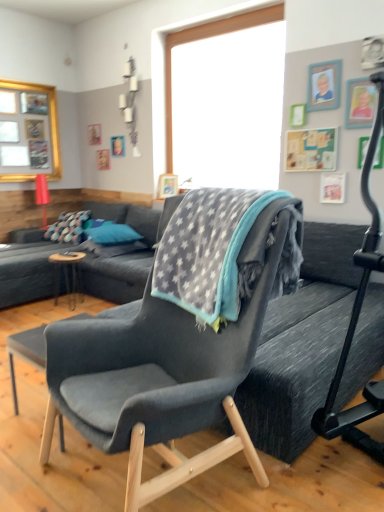
Question: From a real-world perspective, is blue fabric pillow at center physically above dark gray fabric couch at left?

Choices:
 (A) no
 (B) yes

Answer: (B)

Question: Is blue fabric pillow at center oriented towards dark gray fabric couch at left?

Choices:
 (A) yes
 (B) no

Answer: (B)

Question: Considering the relative positions of blue fabric pillow at center and dark gray fabric couch at left in the image provided, is blue fabric pillow at center to the right of dark gray fabric couch at left from the viewer's perspective?

Choices:
 (A) yes
 (B) no

Answer: (A)

Question: Is blue fabric pillow at center outside dark gray fabric couch at left?

Choices:
 (A) yes
 (B) no

Answer: (A)

Question: Is dark gray fabric couch at left at the back of blue fabric pillow at center?

Choices:
 (A) yes
 (B) no

Answer: (A)

Question: Does blue fabric pillow at center lie behind dark gray fabric couch at left?

Choices:
 (A) yes
 (B) no

Answer: (A)

Question: Does gold-framed picture at upper left have a lesser width compared to brown wooden table at center?

Choices:
 (A) yes
 (B) no

Answer: (A)

Question: Is gold-framed picture at upper left bigger than brown wooden table at center?

Choices:
 (A) no
 (B) yes

Answer: (B)

Question: Does gold-framed picture at upper left have a smaller size compared to brown wooden table at center?

Choices:
 (A) yes
 (B) no

Answer: (B)

Question: Can you confirm if gold-framed picture at upper left is positioned to the right of brown wooden table at center?

Choices:
 (A) yes
 (B) no

Answer: (B)

Question: Is gold-framed picture at upper left beside brown wooden table at center?

Choices:
 (A) no
 (B) yes

Answer: (A)

Question: Is gold-framed picture at upper left facing away from brown wooden table at center?

Choices:
 (A) yes
 (B) no

Answer: (B)

Question: Is gray fleece blanket at center positioned beyond the bounds of black rubber baby carriage at right?

Choices:
 (A) yes
 (B) no

Answer: (A)